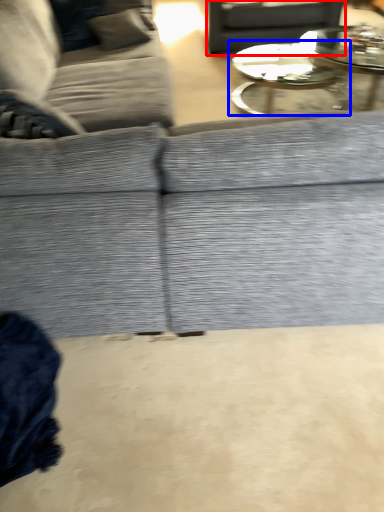
Question: Which point is further to the camera, gray (highlighted by a red box) or coffee table (highlighted by a blue box)?

Choices:
 (A) gray
 (B) coffee table

Answer: (A)